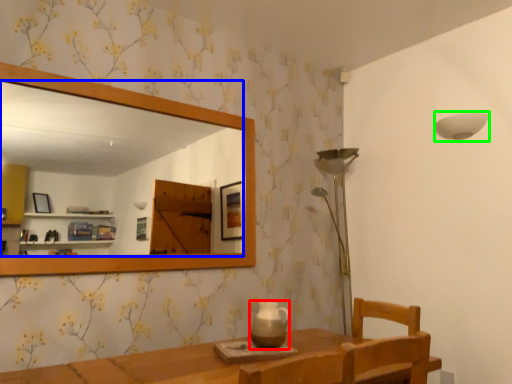
Question: Estimate the real-world distances between objects in this image. Which object is closer to tea pot (highlighted by a red box), mirror (highlighted by a blue box) or lamp (highlighted by a green box)?

Choices:
 (A) mirror
 (B) lamp

Answer: (B)